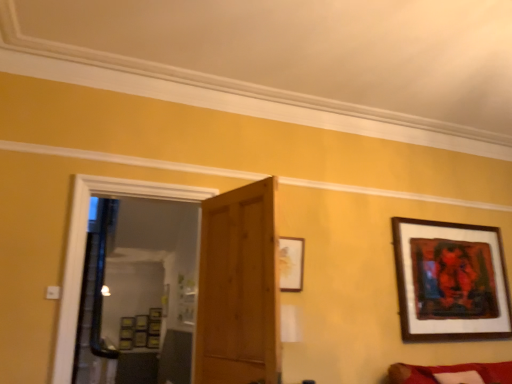
Question: Is wooden picture frame at center, acting as the fourth picture frame starting from the right, inside wooden door at center?

Choices:
 (A) yes
 (B) no

Answer: (B)

Question: Is wooden door at center touching wooden picture frame at center, the 4th picture frame from the top?

Choices:
 (A) yes
 (B) no

Answer: (B)

Question: Considering the relative sizes of wooden door at center and wooden picture frame at center, the second picture frame in the back-to-front sequence, in the image provided, is wooden door at center wider than wooden picture frame at center, the second picture frame in the back-to-front sequence,?

Choices:
 (A) no
 (B) yes

Answer: (B)

Question: Can you confirm if wooden door at center is smaller than wooden picture frame at center, the 4th picture frame from the top?

Choices:
 (A) yes
 (B) no

Answer: (B)

Question: From the image's perspective, is wooden door at center above wooden picture frame at center, which ranks as the third picture frame in front-to-back order?

Choices:
 (A) no
 (B) yes

Answer: (B)

Question: Does wooden door at center have a greater height compared to wooden picture frame at center, which ranks as the third picture frame in front-to-back order?

Choices:
 (A) no
 (B) yes

Answer: (B)

Question: From a real-world perspective, does wooden picture frame at center, which ranks as the third picture frame in front-to-back order, sit lower than velvet red couch at lower right?

Choices:
 (A) no
 (B) yes

Answer: (A)

Question: Can you confirm if wooden picture frame at center, the first picture frame when ordered from left to right, is thinner than velvet red couch at lower right?

Choices:
 (A) no
 (B) yes

Answer: (B)

Question: From the image's perspective, is wooden picture frame at center, the 4th picture frame from the top, on top of velvet red couch at lower right?

Choices:
 (A) yes
 (B) no

Answer: (B)

Question: Is wooden picture frame at center, acting as the fourth picture frame starting from the right, positioned before velvet red couch at lower right?

Choices:
 (A) yes
 (B) no

Answer: (B)

Question: Is wooden picture frame at center, acting as the fourth picture frame starting from the right, oriented away from velvet red couch at lower right?

Choices:
 (A) no
 (B) yes

Answer: (A)

Question: Can you confirm if wooden picture frame at center, which is the 1th picture frame in bottom-to-top order, is smaller than velvet red couch at lower right?

Choices:
 (A) yes
 (B) no

Answer: (A)

Question: Would you consider wooden picture frame at center, acting as the fourth picture frame starting from the right, to be distant from matte gold picture frame at upper center, which is counted as the 1th picture frame, starting from the front?

Choices:
 (A) no
 (B) yes

Answer: (B)